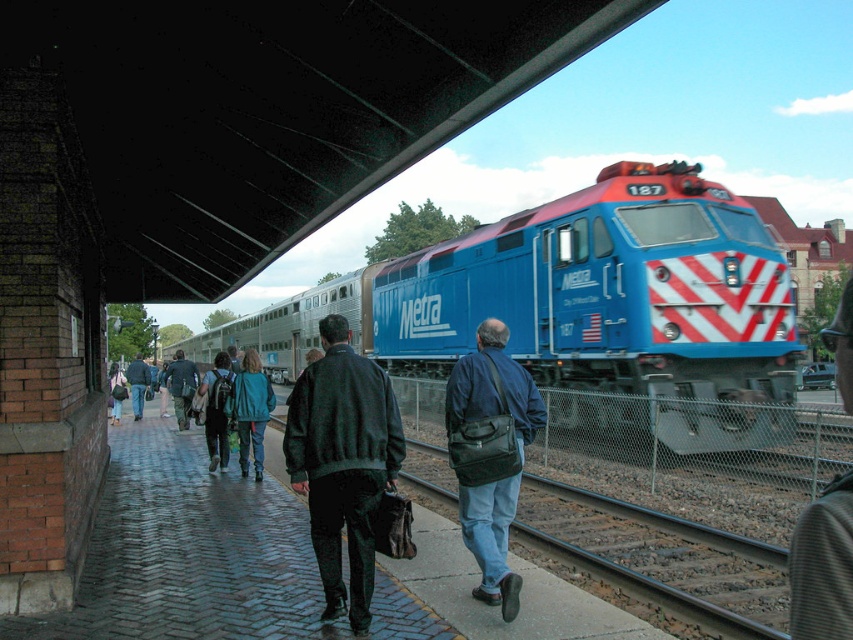
Question: From the image, what is the correct spatial relationship of dark blue leather jacket at center in relation to dark green jacket at center?

Choices:
 (A) right
 (B) left

Answer: (A)

Question: Is dark blue leather jacket at center in front of dark blue jacket at center?

Choices:
 (A) no
 (B) yes

Answer: (B)

Question: Which object is farther from the camera taking this photo?

Choices:
 (A) dark gray jacket at center
 (B) dark blue backpack at center
 (C) dark blue leather jacket at center
 (D) denim jacket at left

Answer: (D)

Question: Does dark blue leather jacket at center lie in front of dark gray jacket at center?

Choices:
 (A) yes
 (B) no

Answer: (B)

Question: Which point is closer to the camera?

Choices:
 (A) denim jacket at left
 (B) dark blue backpack at center

Answer: (B)

Question: Which point appears farthest from the camera in this image?

Choices:
 (A) (834, 362)
 (B) (352, 460)
 (C) (183, 422)
 (D) (138, 403)

Answer: (A)